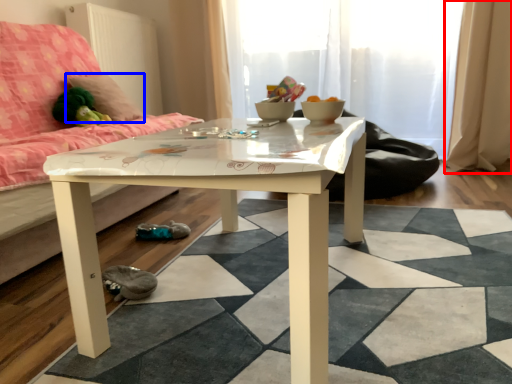
Question: Which of the following is the closest to the observer, curtain (highlighted by a red box) or pillow (highlighted by a blue box)?

Choices:
 (A) curtain
 (B) pillow

Answer: (B)